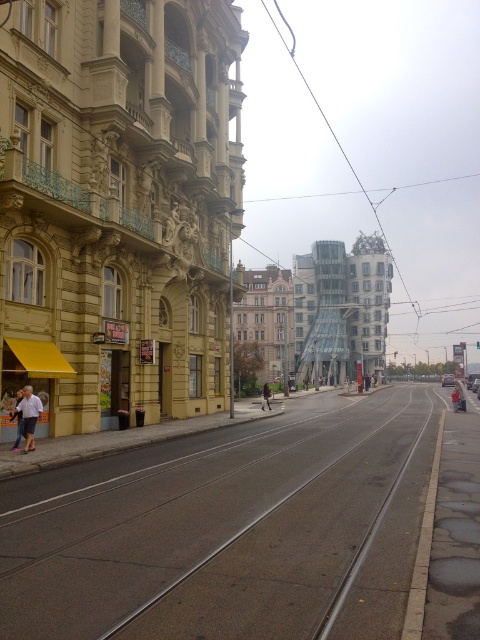
Question: Is black asphalt train track at center further to the viewer compared to dark brown leather jacket at center?

Choices:
 (A) no
 (B) yes

Answer: (A)

Question: Which is nearer to the black asphalt train track at center?

Choices:
 (A) light blue denim jacket at center
 (B) dark brown leather jacket at center
 (C) white shirt at left

Answer: (C)

Question: Among these points, which one is nearest to the camera?

Choices:
 (A) click(34, 424)
 (B) click(403, 417)
 (C) click(265, 388)
 (D) click(457, 403)

Answer: (A)

Question: Is white shirt at left to the right of light blue denim jacket at center from the viewer's perspective?

Choices:
 (A) yes
 (B) no

Answer: (B)

Question: Is white shirt at left to the right of dark brown leather jacket at center from the viewer's perspective?

Choices:
 (A) no
 (B) yes

Answer: (A)

Question: Based on their relative distances, which object is farther from the black asphalt train track at center?

Choices:
 (A) white shirt at left
 (B) light blue denim jacket at center
 (C) dark brown leather jacket at center

Answer: (C)